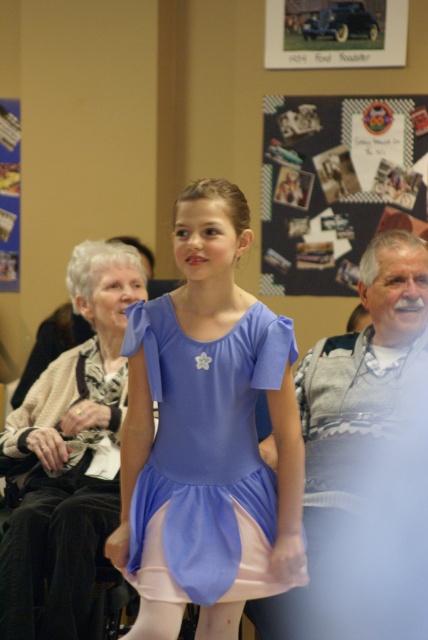
Based on the photo, you are an interior designer planning to place two items in a room. The matte purple fabric dress at center and the metallic silver car at upper center. Which item has a smaller width?

The matte purple fabric dress at center is thinner than the metallic silver car at upper center, so the matte purple fabric dress at center has a smaller width.

You are standing in the community center and looking at the scene. There are two points marked in the image. The first point is at coordinates point (204, 532) and the second point is at point (386, 58). Which of these two points is closer to your viewpoint?

Point (204, 532) is closer to the camera than point (386, 58).